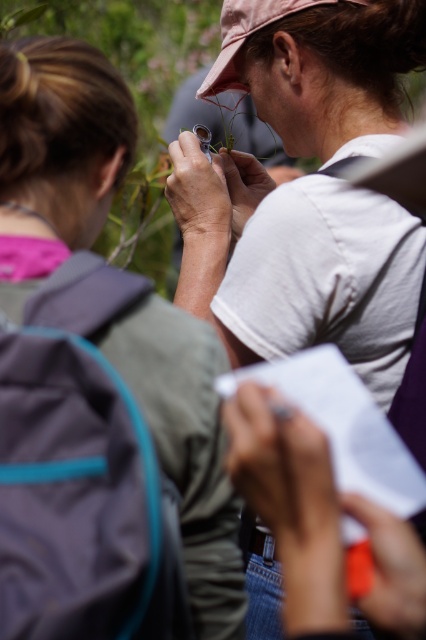
Can you confirm if white matte shirt at center is positioned above pink fabric baseball cap at upper center?

No, white matte shirt at center is not above pink fabric baseball cap at upper center.

Can you confirm if white matte shirt at center is shorter than pink fabric baseball cap at upper center?

In fact, white matte shirt at center may be taller than pink fabric baseball cap at upper center.

Is point (374, 342) behind point (282, 12)?

No.

You are a GUI agent. You are given a task and a screenshot of the screen. Output one action in this format:
    pyautogui.click(x=<x>, y=<y>)
    Task: Click on the white matte shirt at center
    
    Given the screenshot: What is the action you would take?
    pyautogui.click(x=307, y=189)